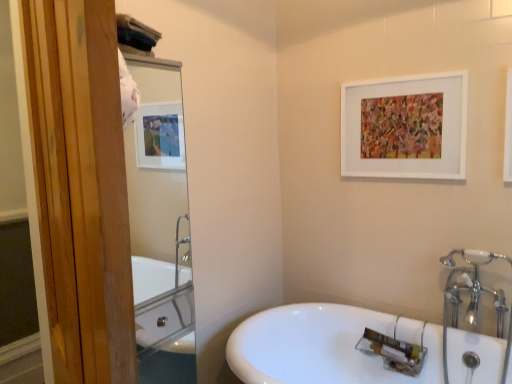
Question: Can you confirm if white glossy sink at lower center is wider than white ceramic faucet at upper right?

Choices:
 (A) no
 (B) yes

Answer: (B)

Question: Can you confirm if white glossy sink at lower center is shorter than white ceramic faucet at upper right?

Choices:
 (A) yes
 (B) no

Answer: (A)

Question: From the image's perspective, is white glossy sink at lower center below white ceramic faucet at upper right?

Choices:
 (A) yes
 (B) no

Answer: (A)

Question: Is white glossy sink at lower center facing away from white ceramic faucet at upper right?

Choices:
 (A) no
 (B) yes

Answer: (A)

Question: Does white glossy sink at lower center have a smaller size compared to white ceramic faucet at upper right?

Choices:
 (A) yes
 (B) no

Answer: (B)

Question: From the image's perspective, is white matte picture frame at upper center positioned above or below white glossy sink at lower center?

Choices:
 (A) above
 (B) below

Answer: (A)

Question: Is point (458, 173) positioned closer to the camera than point (244, 322)?

Choices:
 (A) closer
 (B) farther

Answer: (A)

Question: Is white matte picture frame at upper center to the left or to the right of white glossy sink at lower center in the image?

Choices:
 (A) left
 (B) right

Answer: (B)

Question: Considering their positions, is white matte picture frame at upper center located in front of or behind white glossy sink at lower center?

Choices:
 (A) front
 (B) behind

Answer: (B)

Question: In the image, is white matte picture frame at upper center positioned in front of or behind white ceramic faucet at upper right?

Choices:
 (A) front
 (B) behind

Answer: (B)

Question: Considering the relative positions of white matte picture frame at upper center and white ceramic faucet at upper right in the image provided, is white matte picture frame at upper center to the left or to the right of white ceramic faucet at upper right?

Choices:
 (A) right
 (B) left

Answer: (B)

Question: Which is correct: white matte picture frame at upper center is inside white ceramic faucet at upper right, or outside of it?

Choices:
 (A) inside
 (B) outside

Answer: (B)

Question: Is white matte picture frame at upper center bigger or smaller than white ceramic faucet at upper right?

Choices:
 (A) small
 (B) big

Answer: (A)

Question: Is point (270, 382) closer or farther from the camera than point (186, 340)?

Choices:
 (A) closer
 (B) farther

Answer: (B)

Question: Is white glossy sink at lower center bigger or smaller than clear glass mirror at upper left?

Choices:
 (A) big
 (B) small

Answer: (A)